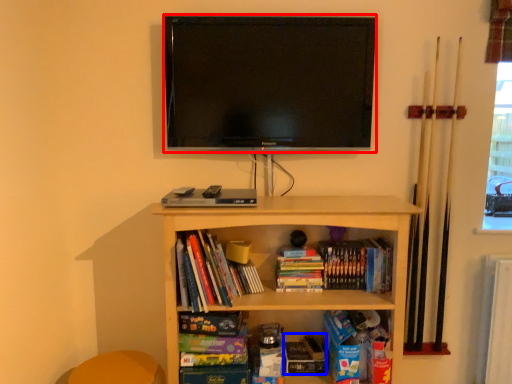
Question: Which object is further to the camera taking this photo, television (highlighted by a red box) or paperback book (highlighted by a blue box)?

Choices:
 (A) television
 (B) paperback book

Answer: (B)